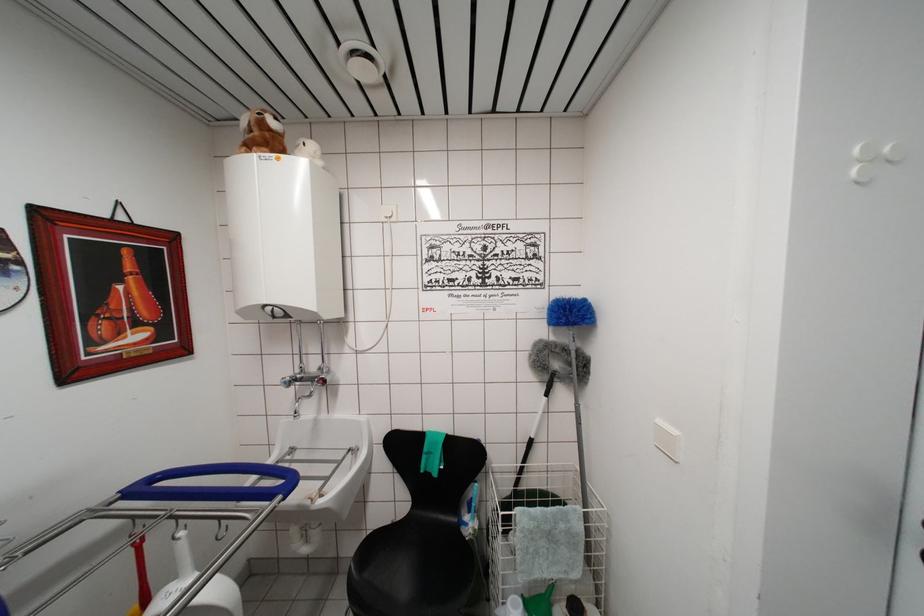
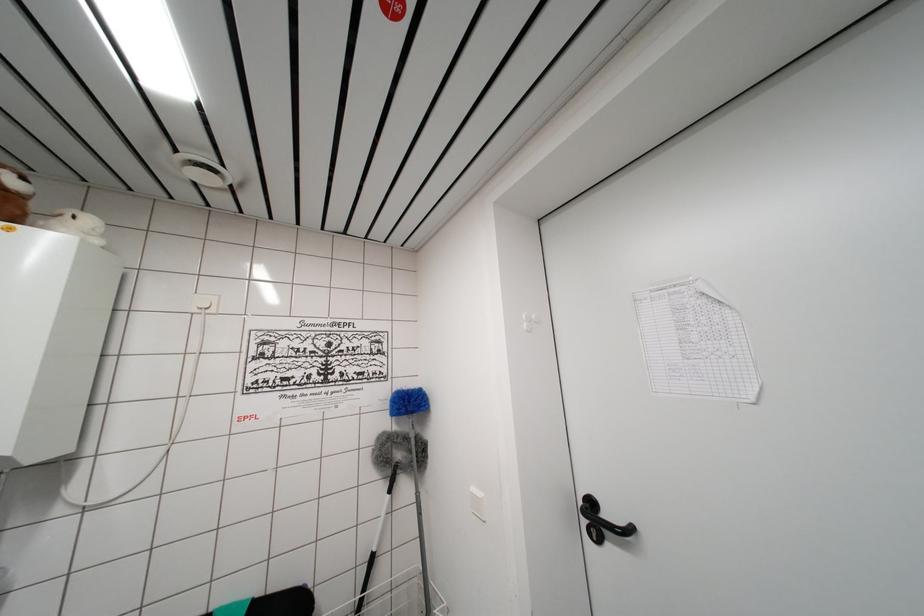
The first image is from the beginning of the video and the second image is from the end. How did the camera likely rotate when shooting the video?

The rotation direction of the camera is right-up.